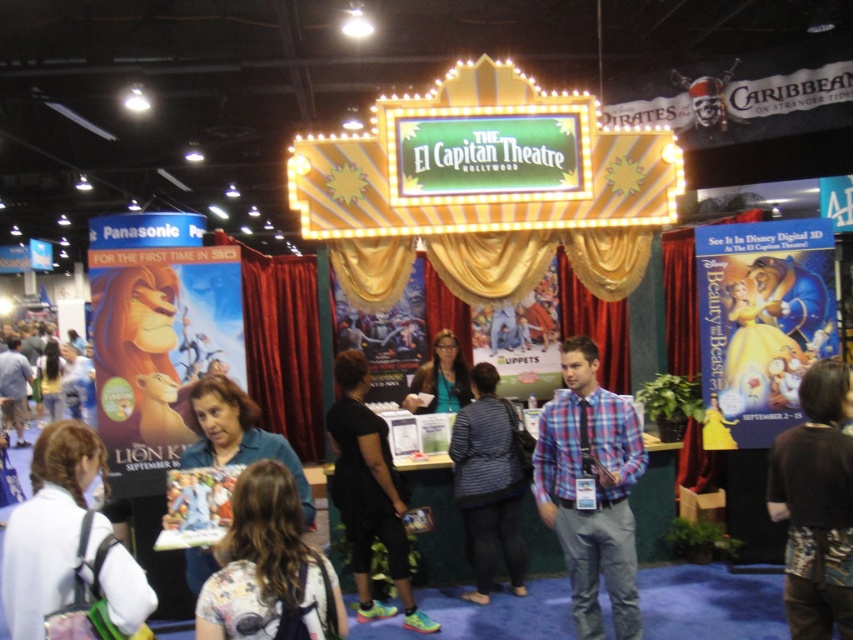
Question: Which point is closer to the camera taking this photo?

Choices:
 (A) (814, 616)
 (B) (440, 388)

Answer: (A)

Question: Which point is farther from the camera taking this photo?

Choices:
 (A) (517, 522)
 (B) (399, 584)

Answer: (A)

Question: Is floral shirt at center positioned before matte black shirt at lower left?

Choices:
 (A) yes
 (B) no

Answer: (A)

Question: Is white fabric backpack at lower left thinner than matte green shirt at center?

Choices:
 (A) no
 (B) yes

Answer: (A)

Question: Which point is farther to the camera?

Choices:
 (A) (512, 509)
 (B) (71, 493)
 (C) (430, 362)
 (D) (224, 624)

Answer: (C)

Question: Is black fabric dress at center to the left of matte green shirt at center from the viewer's perspective?

Choices:
 (A) yes
 (B) no

Answer: (A)